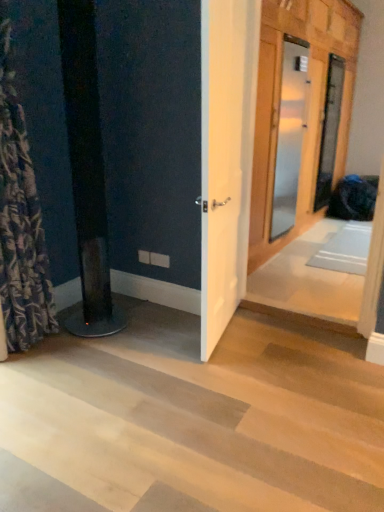
The height and width of the screenshot is (512, 384). Identify the location of free space in front of black glossy speaker at left. (91, 356).